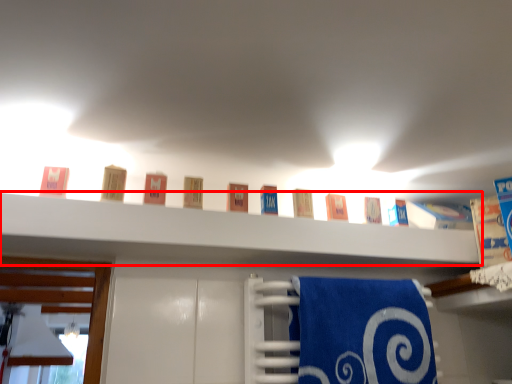
Question: From the image's perspective, what is the correct spatial positioning of shelf (annotated by the red box) in reference to bath towel?

Choices:
 (A) below
 (B) above

Answer: (B)